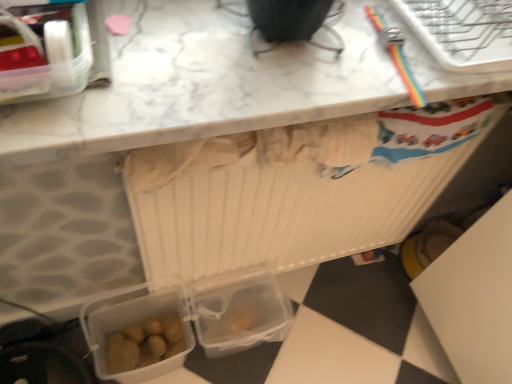
Identify the location of vacant point above transparent plastic lunch box at lower center, positioned as the 2th lunch box in bottom-to-top order (from a real-world perspective). (239, 295).